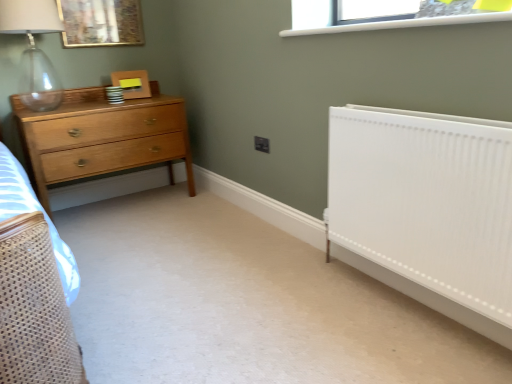
Locate an element on the screen. This screenshot has height=384, width=512. vacant space that is to the left of white smooth radiator at right is located at coordinates pyautogui.click(x=276, y=306).